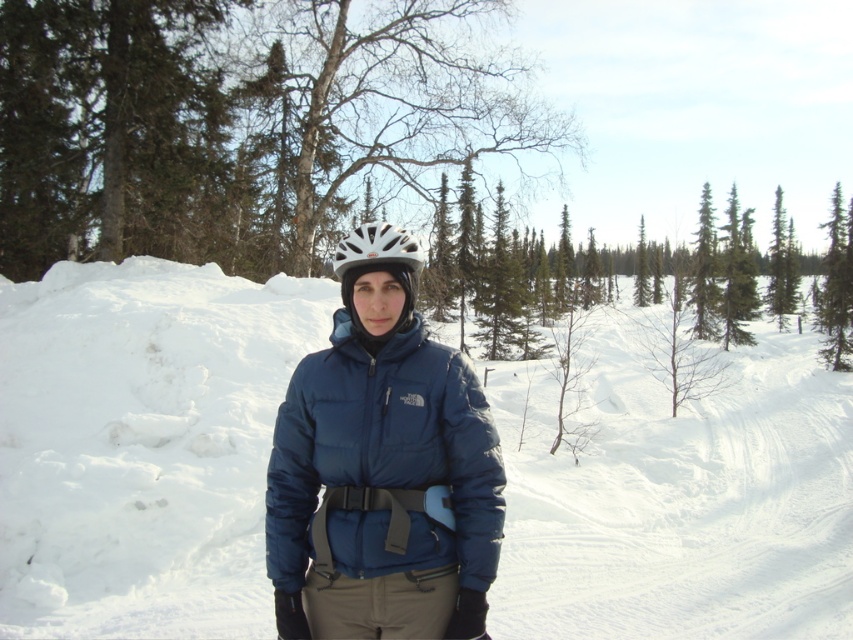
You are a drone operator trying to locate a person in a snowy area. The person is wearing a dark blue puffer jacket with The North Face logo. According to the image, where is the matte blue jacket at center located relative to the point marked at coordinates (142, 445)?

The point at coordinates (142, 445) marks the location of the matte blue jacket at center, so it is exactly at that point.

You are a clothing designer observing the snowy landscape scene. You notice the matte blue jacket at center and the navy blue down jacket at center. Which jacket would you recommend for a client who prioritizes warmth retention based on their size?

The matte blue jacket at center is larger in size than the navy blue down jacket at center, so it likely offers better warmth retention due to its increased insulation capacity from the extra material.

You are a drone operator trying to deliver a small package to a person wearing a matte blue jacket at center. The drone can only fly 5 meters before needing to recharge. Can the drone reach the person without needing to recharge?

The distance between the drone and the matte blue jacket at center is 5.37 meters, which exceeds the drone flight range of 5 meters. The drone cannot reach the person without recharging.